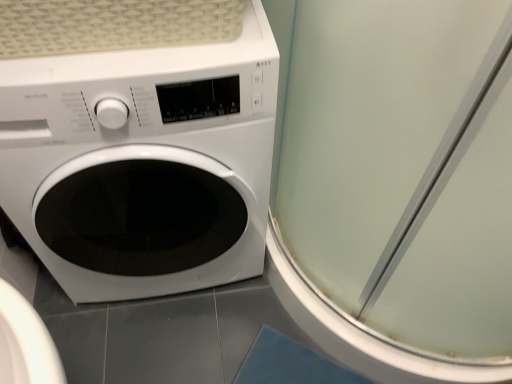
The image size is (512, 384). What do you see at coordinates (396, 184) in the screenshot? I see `transparent glass screen door at right` at bounding box center [396, 184].

I want to click on transparent glass screen door at right, so click(396, 184).

Locate an element on the screen. The width and height of the screenshot is (512, 384). white glossy washing machine at left is located at coordinates (143, 163).

Describe the element at coordinates (143, 163) in the screenshot. I see `white glossy washing machine at left` at that location.

Locate an element on the screen. Image resolution: width=512 pixels, height=384 pixels. transparent glass screen door at right is located at coordinates (396, 184).

Considering the relative positions of transparent glass screen door at right and white glossy washing machine at left in the image provided, is transparent glass screen door at right to the right of white glossy washing machine at left from the viewer's perspective?

Yes, transparent glass screen door at right is to the right of white glossy washing machine at left.

In the image, is transparent glass screen door at right positioned in front of or behind white glossy washing machine at left?

transparent glass screen door at right is in front of white glossy washing machine at left.

Is point (281, 132) farther from viewer compared to point (203, 163)?

Yes, point (281, 132) is behind point (203, 163).

From the image's perspective, is transparent glass screen door at right positioned above or below white glossy washing machine at left?

transparent glass screen door at right is situated higher than white glossy washing machine at left in the image.

From a real-world perspective, is transparent glass screen door at right on white glossy washing machine at left?

Yes, from a real-world perspective, transparent glass screen door at right is on top of white glossy washing machine at left.

Looking at their sizes, would you say transparent glass screen door at right is wider or thinner than white glossy washing machine at left?

Considering their sizes, transparent glass screen door at right looks broader than white glossy washing machine at left.

Who is shorter, transparent glass screen door at right or white glossy washing machine at left?

white glossy washing machine at left.

Can you confirm if transparent glass screen door at right is smaller than white glossy washing machine at left?

Incorrect, transparent glass screen door at right is not smaller in size than white glossy washing machine at left.

Is transparent glass screen door at right surrounding white glossy washing machine at left?

That's incorrect, white glossy washing machine at left is not inside transparent glass screen door at right.

Is transparent glass screen door at right beside white glossy washing machine at left?

No, transparent glass screen door at right is not touching white glossy washing machine at left.

Is transparent glass screen door at right facing away from white glossy washing machine at left?

transparent glass screen door at right is not turned away from white glossy washing machine at left.

Can you tell me how much transparent glass screen door at right and white glossy washing machine at left differ in facing direction?

The angular difference between transparent glass screen door at right and white glossy washing machine at left is 1.02e-05 degrees.

Locate an element on the screen. This screenshot has height=384, width=512. screen door lying in front of the white glossy washing machine at left is located at coordinates pos(396,184).

Considering the positions of objects white glossy washing machine at left and transparent glass screen door at right in the image provided, who is more to the right, white glossy washing machine at left or transparent glass screen door at right?

Positioned to the right is transparent glass screen door at right.

Which is behind, white glossy washing machine at left or transparent glass screen door at right?

white glossy washing machine at left is further from the camera.

Is point (249, 236) farther from camera compared to point (464, 47)?

Yes, it is behind point (464, 47).

From the image's perspective, is white glossy washing machine at left located above transparent glass screen door at right?

No, from the image's perspective, white glossy washing machine at left is not over transparent glass screen door at right.

From a real-world perspective, between white glossy washing machine at left and transparent glass screen door at right, who is vertically lower?

white glossy washing machine at left is physically lower.

Based on the photo, can you confirm if white glossy washing machine at left is wider than transparent glass screen door at right?

In fact, white glossy washing machine at left might be narrower than transparent glass screen door at right.

Considering the relative sizes of white glossy washing machine at left and transparent glass screen door at right in the image provided, is white glossy washing machine at left shorter than transparent glass screen door at right?

Yes.

Is white glossy washing machine at left bigger than transparent glass screen door at right?

Actually, white glossy washing machine at left might be smaller than transparent glass screen door at right.

Would you say white glossy washing machine at left is inside or outside transparent glass screen door at right?

white glossy washing machine at left is located beyond the bounds of transparent glass screen door at right.

Are white glossy washing machine at left and transparent glass screen door at right making contact?

No, white glossy washing machine at left is not making contact with transparent glass screen door at right.

From the picture: Is white glossy washing machine at left facing towards transparent glass screen door at right?

No, white glossy washing machine at left is not oriented towards transparent glass screen door at right.

From the picture: What's the angular difference between white glossy washing machine at left and transparent glass screen door at right's facing directions?

white glossy washing machine at left and transparent glass screen door at right are facing 1.02e-05 degrees away from each other.

How distant is white glossy washing machine at left from transparent glass screen door at right?

white glossy washing machine at left is 12.32 inches away from transparent glass screen door at right.

You are a GUI agent. You are given a task and a screenshot of the screen. Output one action in this format:
    pyautogui.click(x=<x>, y=<y>)
    Task: Click on the washing machine on the left of the transparent glass screen door at right
    
    Given the screenshot: What is the action you would take?
    pyautogui.click(x=143, y=163)

What are the coordinates of `washing machine to the left of transparent glass screen door at right` in the screenshot? It's located at (143, 163).

The width and height of the screenshot is (512, 384). Identify the location of screen door above the white glossy washing machine at left (from the image's perspective). (396, 184).